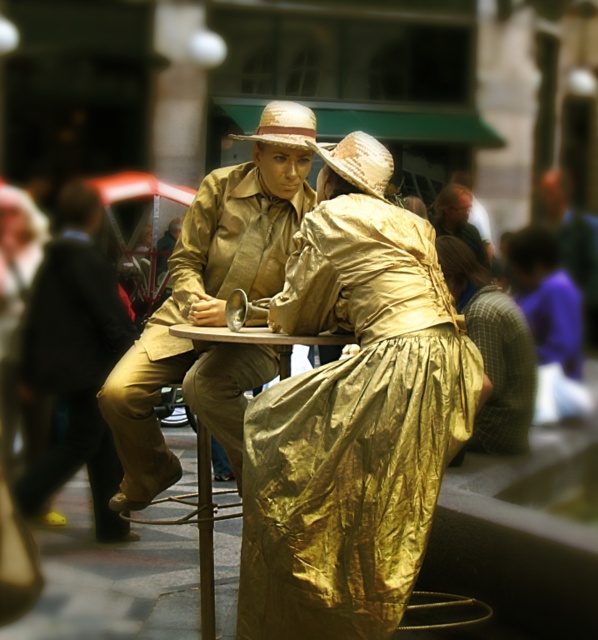
Does matte khaki jacket at center have a larger size compared to gold foil dress at center?

No, matte khaki jacket at center is not bigger than gold foil dress at center.

Between point (208, 387) and point (471, 237), which one is positioned behind?

Point (471, 237)

In order to click on matte khaki jacket at center in this screenshot , I will do `click(212, 305)`.

Is matte khaki jacket at center to the right of matte black suit at left from the viewer's perspective?

Correct, you'll find matte khaki jacket at center to the right of matte black suit at left.

Does matte khaki jacket at center lie in front of matte black suit at left?

Yes, matte khaki jacket at center is closer to the viewer.

This screenshot has height=640, width=598. Identify the location of matte khaki jacket at center. (212, 305).

Can you confirm if gold shiny dress at center is taller than matte khaki jacket at center?

No.

Is gold shiny dress at center to the left of matte khaki jacket at center from the viewer's perspective?

No, gold shiny dress at center is not to the left of matte khaki jacket at center.

The width and height of the screenshot is (598, 640). In order to click on gold shiny dress at center in this screenshot , I will do `click(352, 424)`.

Locate an element on the screen. The image size is (598, 640). gold shiny dress at center is located at coordinates (352, 424).